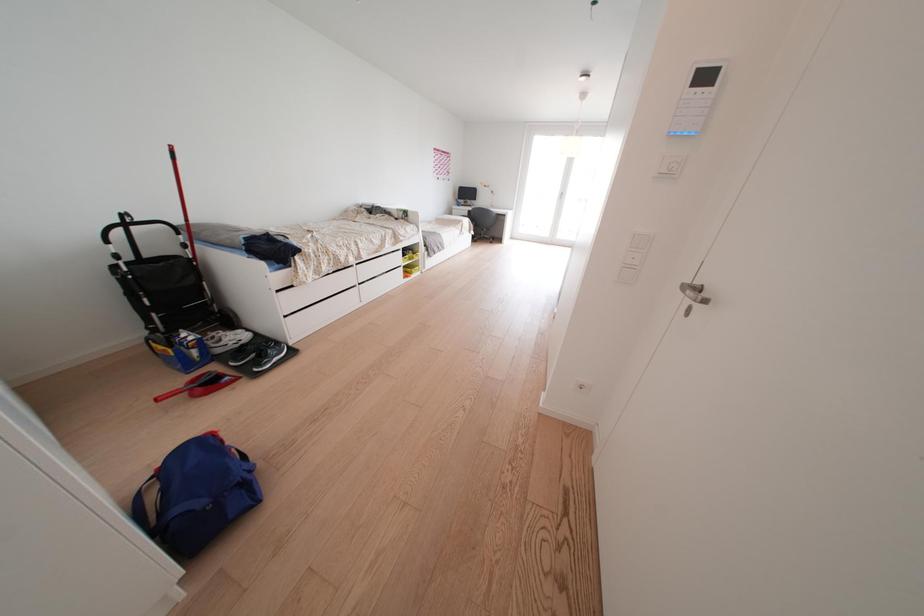
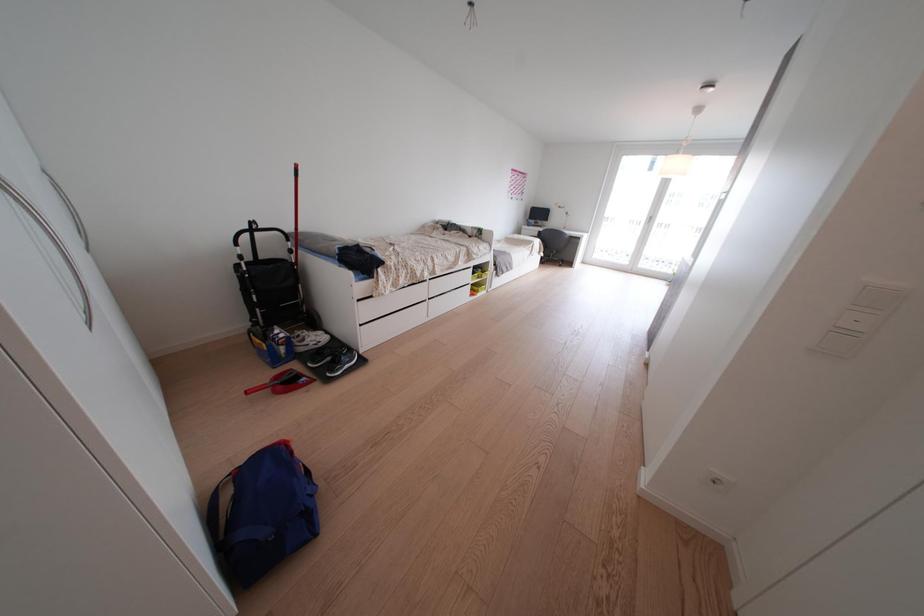
Question: The images are taken continuously from a first-person perspective. In which direction is your viewpoint rotating?

Choices:
 (A) Left
 (B) Right
 (C) Up
 (D) Down

Answer: (A)